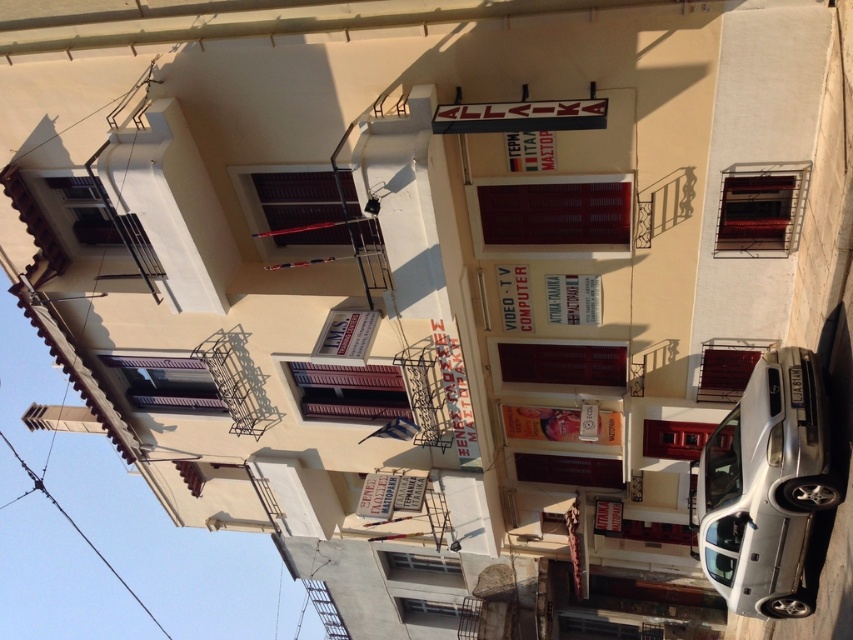
Is metallic balcony at upper right bigger than metallic red balcony at center?

Yes.

Between metallic balcony at upper right and metallic red balcony at center, which one appears on the left side from the viewer's perspective?

metallic balcony at upper right

At what (x,y) coordinates should I click in order to perform the action: click on metallic balcony at upper right. Please return your answer as a coordinate pair (x, y). The image size is (853, 640). Looking at the image, I should click on (759, 209).

Who is positioned more to the right, silver metallic car at lower right or metallic balcony at upper right?

Positioned to the right is silver metallic car at lower right.

Does silver metallic car at lower right have a lesser height compared to metallic balcony at upper right?

In fact, silver metallic car at lower right may be taller than metallic balcony at upper right.

Is point (738, 561) more distant than point (753, 182)?

Yes, it is behind point (753, 182).

Where is `silver metallic car at lower right`? This screenshot has height=640, width=853. silver metallic car at lower right is located at coordinates (766, 486).

Does silver metallic car at lower right appear under metallic red balcony at center?

Yes.

Does silver metallic car at lower right have a lesser width compared to metallic red balcony at center?

No.

At what (x,y) coordinates should I click in order to perform the action: click on silver metallic car at lower right. Please return your answer as a coordinate pair (x, y). The image size is (853, 640). Looking at the image, I should click on (766, 486).

The image size is (853, 640). Identify the location of silver metallic car at lower right. (766, 486).